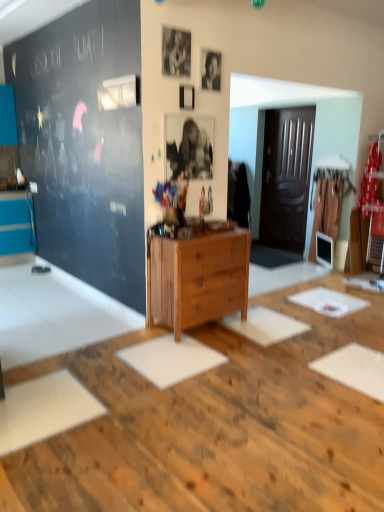
Question: From the image's perspective, does wooden chest of drawers at center appear lower than white matte table at center?

Choices:
 (A) yes
 (B) no

Answer: (B)

Question: Does wooden chest of drawers at center have a greater width compared to white matte table at center?

Choices:
 (A) yes
 (B) no

Answer: (B)

Question: Is the depth of wooden chest of drawers at center greater than that of white matte table at center?

Choices:
 (A) no
 (B) yes

Answer: (B)

Question: From the image's perspective, is wooden chest of drawers at center over white matte table at center?

Choices:
 (A) yes
 (B) no

Answer: (A)

Question: From a real-world perspective, does wooden chest of drawers at center stand above white matte table at center?

Choices:
 (A) no
 (B) yes

Answer: (B)

Question: Is wooden chest of drawers at center surrounding white matte table at center?

Choices:
 (A) yes
 (B) no

Answer: (B)

Question: Is white matte table at center to the left of wooden chest of drawers at center from the viewer's perspective?

Choices:
 (A) no
 (B) yes

Answer: (B)

Question: From the image's perspective, is white matte table at center located above wooden chest of drawers at center?

Choices:
 (A) no
 (B) yes

Answer: (A)

Question: From the image's perspective, is white matte table at center beneath wooden chest of drawers at center?

Choices:
 (A) yes
 (B) no

Answer: (A)

Question: Does white matte table at center have a lesser width compared to wooden chest of drawers at center?

Choices:
 (A) yes
 (B) no

Answer: (B)

Question: Does white matte table at center have a greater height compared to wooden chest of drawers at center?

Choices:
 (A) yes
 (B) no

Answer: (B)

Question: Can wooden chest of drawers at center be found inside white matte table at center?

Choices:
 (A) no
 (B) yes

Answer: (A)

Question: In terms of size, does white matte table at center appear bigger or smaller than wooden chest of drawers at center?

Choices:
 (A) small
 (B) big

Answer: (B)